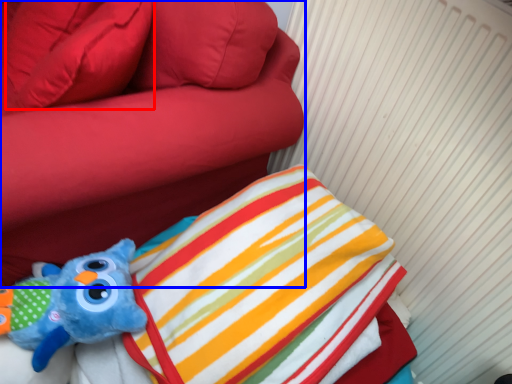
Question: Among these objects, which one is nearest to the camera, pillow (highlighted by a red box) or furniture (highlighted by a blue box)?

Choices:
 (A) pillow
 (B) furniture

Answer: (B)